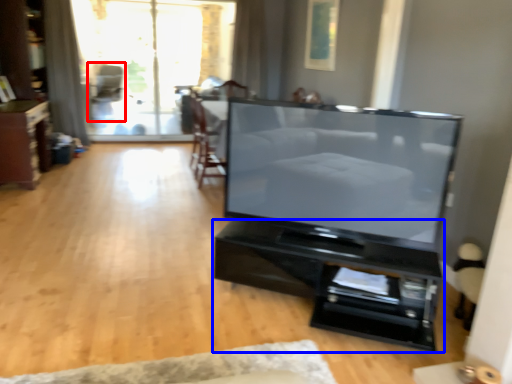
Question: Among these objects, which one is nearest to the camera, armchair (highlighted by a red box) or furniture (highlighted by a blue box)?

Choices:
 (A) armchair
 (B) furniture

Answer: (B)